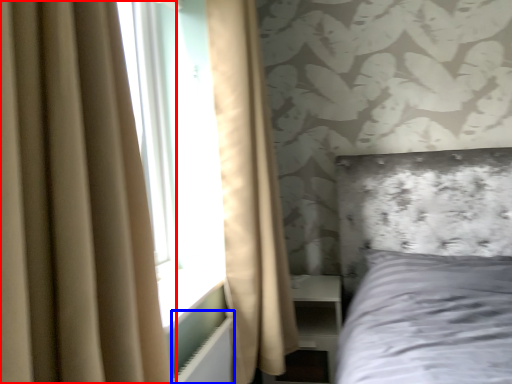
Question: Which object is closer to the camera taking this photo, curtain (highlighted by a red box) or radiator (highlighted by a blue box)?

Choices:
 (A) curtain
 (B) radiator

Answer: (A)